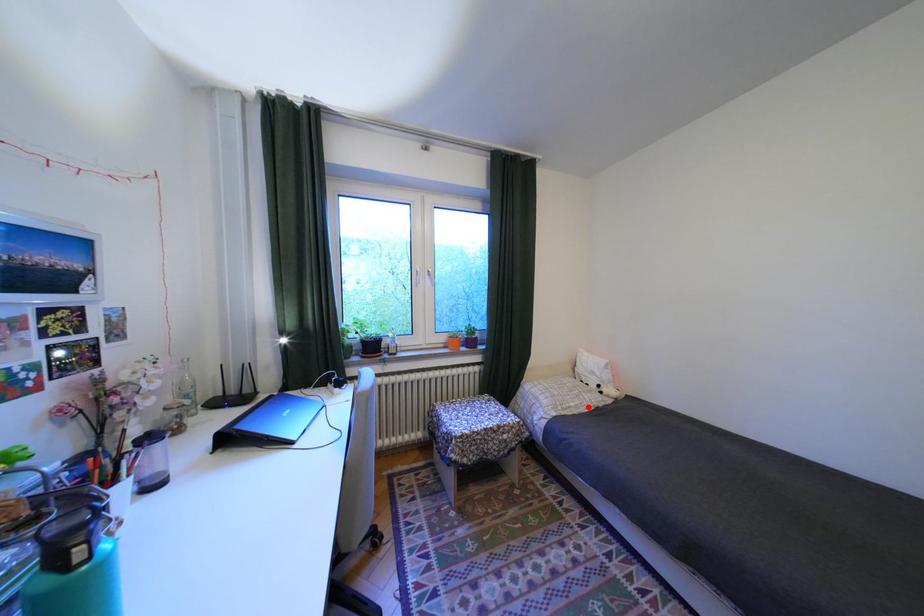
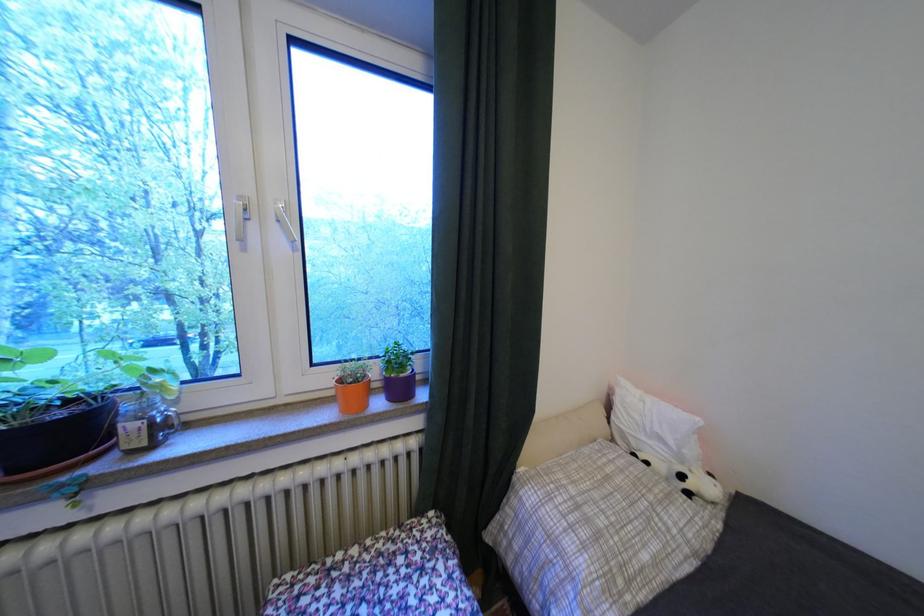
Locate, in the second image, the point that corresponds to the highlighted location in the first image.

(667, 562)